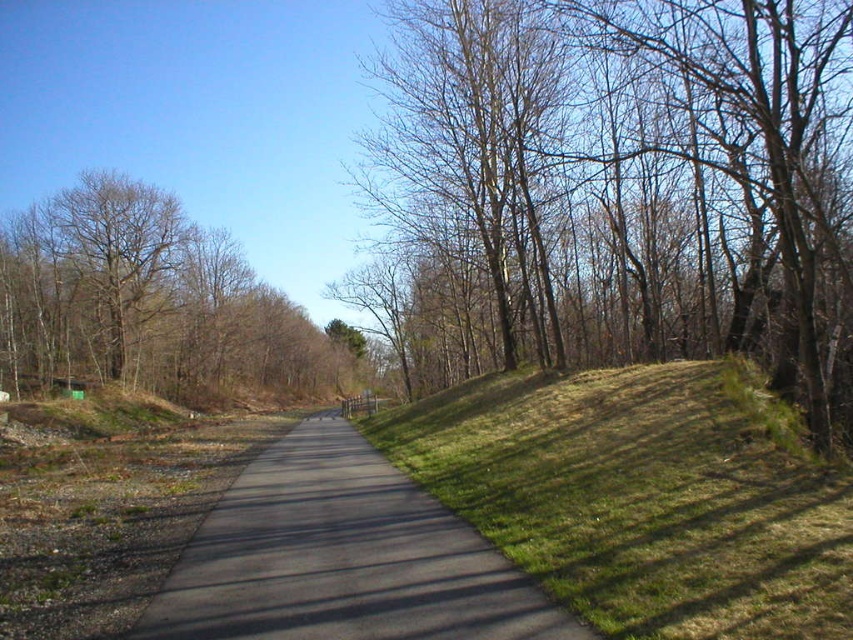
Question: Which object is closer to the camera taking this photo?

Choices:
 (A) green grassy hillside at right
 (B) brown/dry wood trees at right

Answer: (A)

Question: Which point is closer to the camera taking this photo?

Choices:
 (A) (761, 624)
 (B) (410, 548)
 (C) (642, 1)

Answer: (A)

Question: Considering the relative positions of brown/dry wood trees at right and green grassy hillside at right in the image provided, where is brown/dry wood trees at right located with respect to green grassy hillside at right?

Choices:
 (A) left
 (B) right

Answer: (A)

Question: Does green grassy hillside at right appear under brown leafless tree at left?

Choices:
 (A) no
 (B) yes

Answer: (B)

Question: From the image, what is the correct spatial relationship of brown/dry wood trees at right in relation to brown leafless tree at left?

Choices:
 (A) below
 (B) above

Answer: (B)

Question: Which is farther from the brown/dry wood trees at right?

Choices:
 (A) black asphalt path at center
 (B) green grassy hillside at right

Answer: (A)